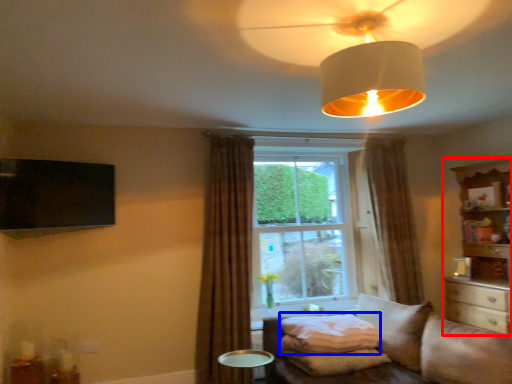
Question: Which of the following is the closest to the observer, entertainment center (highlighted by a red box) or pillow (highlighted by a blue box)?

Choices:
 (A) entertainment center
 (B) pillow

Answer: (B)